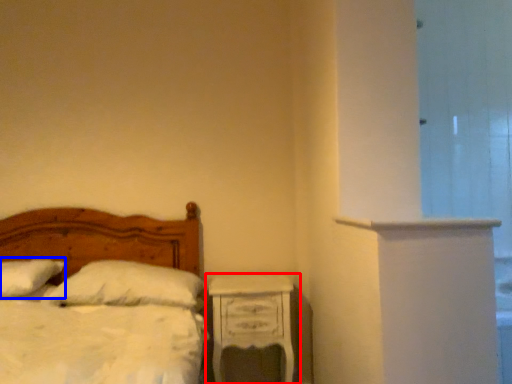
Question: Which object appears farthest to the camera in this image, nightstand (highlighted by a red box) or pillow (highlighted by a blue box)?

Choices:
 (A) nightstand
 (B) pillow

Answer: (A)